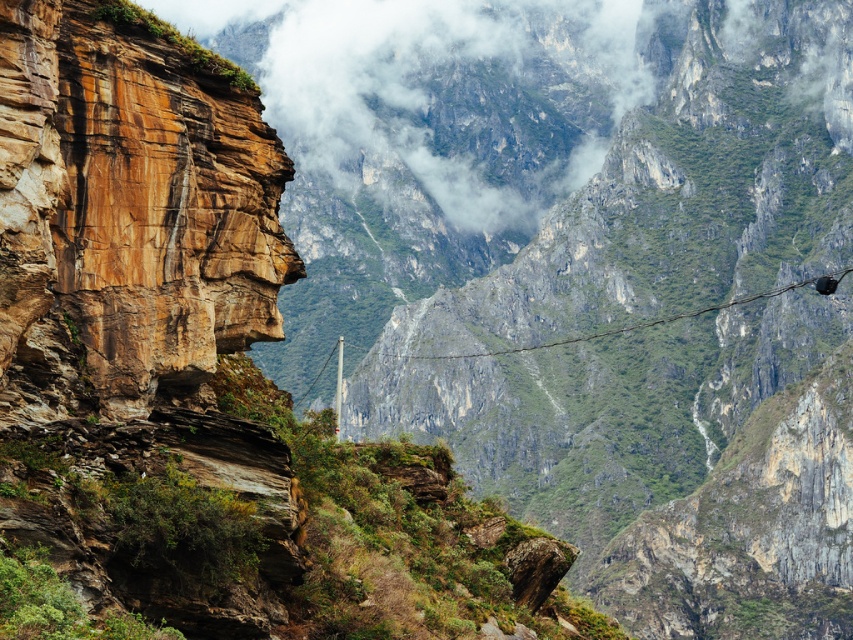
You are a hiker planning to navigate between the rustic stone face at upper left and the rustic wire at center. Given that the wire is part of a communication line, which object has a wider span in the image?

The rustic wire at center has a wider span than the rustic stone face at upper left because the rustic stone face at upper left is narrower than the rustic wire at center according to the description.